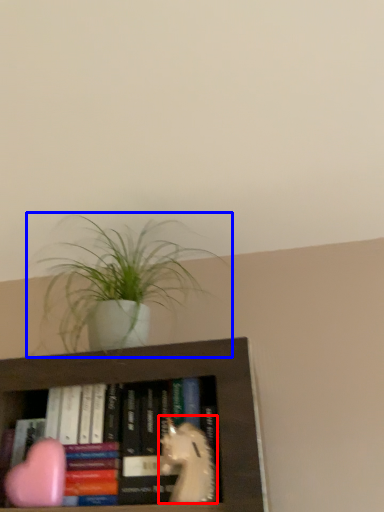
Question: Which object appears farthest to the camera in this image, animal (highlighted by a red box) or houseplant (highlighted by a blue box)?

Choices:
 (A) animal
 (B) houseplant

Answer: (B)